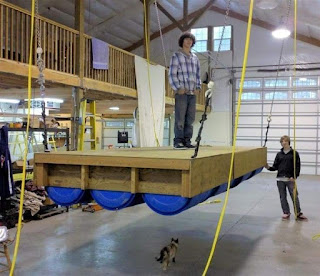
At what (x,y) coordinates should I click in order to perform the action: click on ladder step. Please return your answer as a coordinate pair (x, y). This screenshot has width=320, height=276. Looking at the image, I should click on (88, 142), (88, 128), (90, 113), (20, 143), (52, 142).